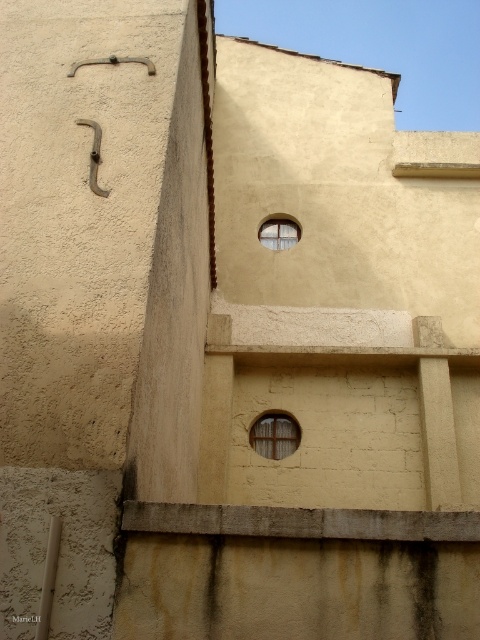
You are a painter who needs to paint the wooden at center and the clear glass window at upper center on the building wall. Which object requires more paint considering their height?

The wooden at center is taller than the clear glass window at upper center, so it requires more paint.

You are a painter standing at the base of the building wall. You need to paint the wooden at center and the clear glass window at upper center. Which object should you paint first if you want to start from the bottom and work your way up?

You should paint the wooden at center first because it is located below the clear glass window at upper center, so starting from the bottom makes sense.

You are standing in front of the building wall and want to place a new decorative plaque exactly at the center of the wooden at center. Given the coordinates provided, where should you place it?

The wooden at center is located at coordinates point [275,435], so you should place the decorative plaque exactly at that point.